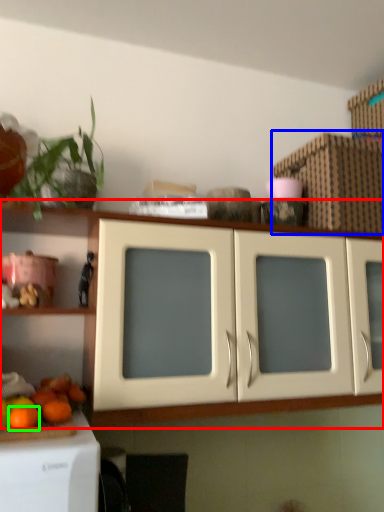
Question: Which object is the farthest from cabinetry (highlighted by a red box)? Choose among these: cardboard box (highlighted by a blue box) or orange (highlighted by a green box).

Choices:
 (A) cardboard box
 (B) orange

Answer: (A)